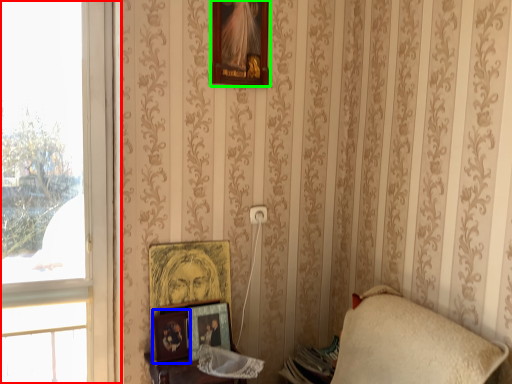
Question: Estimate the real-world distances between objects in this image. Which object is closer to window (highlighted by a red box), picture frame (highlighted by a blue box) or picture frame (highlighted by a green box)?

Choices:
 (A) picture frame
 (B) picture frame

Answer: (A)